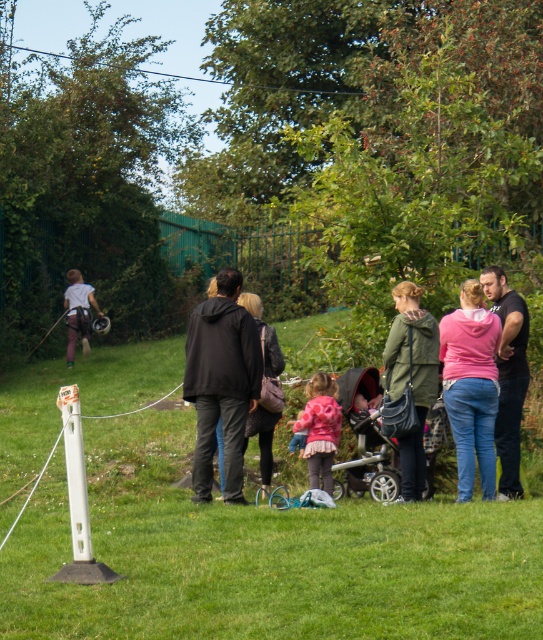
Question: Does pink fleece jacket at right appear on the right side of pink fleece jacket at center?

Choices:
 (A) no
 (B) yes

Answer: (B)

Question: From the image, what is the correct spatial relationship of black matte jacket at center in relation to light gray fabric backpack at left?

Choices:
 (A) right
 (B) left

Answer: (A)

Question: Estimate the real-world distances between objects in this image. Which object is closer to the green matte jacket at center?

Choices:
 (A) pink fleece jacket at center
 (B) black matte jacket at center
 (C) silver metallic stroller at center

Answer: (A)

Question: Estimate the real-world distances between objects in this image. Which object is closer to the silver metallic stroller at center?

Choices:
 (A) light gray fabric backpack at left
 (B) green matte jacket at center
 (C) green grass at lower center

Answer: (B)

Question: Which point is farther from the camera taking this photo?

Choices:
 (A) (78, 317)
 (B) (416, 381)
 (C) (329, 410)
 (D) (515, 387)

Answer: (A)

Question: From the image, what is the correct spatial relationship of green grass at lower center in relation to dark gray hoodie at center?

Choices:
 (A) right
 (B) left

Answer: (B)